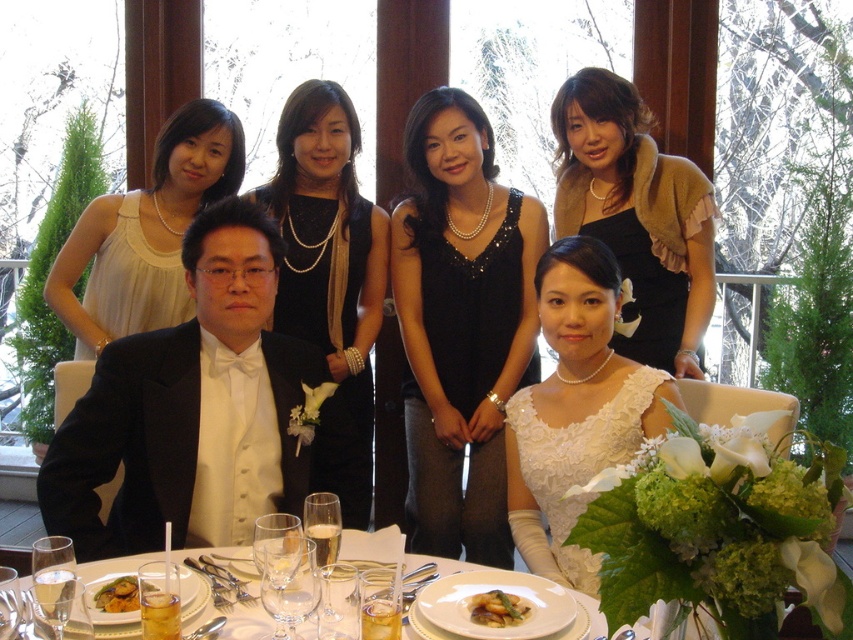
Question: Which object appears farthest from the camera in this image?

Choices:
 (A) matte black dress at center
 (B) white satin dress at upper left
 (C) black satin tuxedo at center

Answer: (B)

Question: Which of the following is the closest to the observer?

Choices:
 (A) white lace dress at center
 (B) white porcelain plates at center
 (C) matte white dress at left

Answer: (B)

Question: Is white satin dress at upper left behind white porcelain plate at center?

Choices:
 (A) no
 (B) yes

Answer: (B)

Question: Can you confirm if black satin tuxedo at center is positioned below white satin dress at center?

Choices:
 (A) yes
 (B) no

Answer: (A)

Question: Is black satin dress at upper center above golden brown crispy fried food at center?

Choices:
 (A) no
 (B) yes

Answer: (B)

Question: Which object is the farthest from the black satin dress at upper center?

Choices:
 (A) matte black dress at center
 (B) matte white dress at left

Answer: (A)